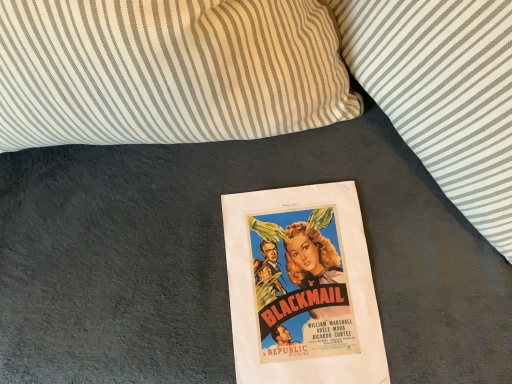
Question: Which direction should I rotate to look at striped fabric pillow at upper center, arranged as the 2th pillow when viewed from the left?

Choices:
 (A) left
 (B) right

Answer: (B)

Question: Is the position of striped fabric pillow at upper center, the 1th pillow from the right, less distant than that of white striped pillow at upper center, the 2th pillow viewed from the right?

Choices:
 (A) no
 (B) yes

Answer: (B)

Question: Is striped fabric pillow at upper center, the 1th pillow from the right, surrounding white striped pillow at upper center, the 2th pillow viewed from the right?

Choices:
 (A) yes
 (B) no

Answer: (B)

Question: Considering the relative sizes of striped fabric pillow at upper center, the 1th pillow from the right, and white striped pillow at upper center, the 2th pillow viewed from the right, in the image provided, is striped fabric pillow at upper center, the 1th pillow from the right, wider than white striped pillow at upper center, the 2th pillow viewed from the right,?

Choices:
 (A) no
 (B) yes

Answer: (B)

Question: Can you confirm if striped fabric pillow at upper center, arranged as the 2th pillow when viewed from the left, is taller than white striped pillow at upper center, the 2th pillow viewed from the right?

Choices:
 (A) yes
 (B) no

Answer: (B)

Question: Can you confirm if striped fabric pillow at upper center, the 1th pillow from the right, is shorter than white striped pillow at upper center, which is the 1th pillow from left to right?

Choices:
 (A) no
 (B) yes

Answer: (B)

Question: Considering the relative sizes of striped fabric pillow at upper center, arranged as the 2th pillow when viewed from the left, and white striped pillow at upper center, the 2th pillow viewed from the right, in the image provided, is striped fabric pillow at upper center, arranged as the 2th pillow when viewed from the left, thinner than white striped pillow at upper center, the 2th pillow viewed from the right,?

Choices:
 (A) no
 (B) yes

Answer: (A)

Question: Can you confirm if white striped pillow at upper center, the 2th pillow viewed from the right, is smaller than striped fabric pillow at upper center, the 1th pillow from the right?

Choices:
 (A) no
 (B) yes

Answer: (A)

Question: From a real-world perspective, is white striped pillow at upper center, which is the 1th pillow from left to right, located higher than striped fabric pillow at upper center, arranged as the 2th pillow when viewed from the left?

Choices:
 (A) yes
 (B) no

Answer: (B)

Question: Is white striped pillow at upper center, the 2th pillow viewed from the right, positioned behind striped fabric pillow at upper center, arranged as the 2th pillow when viewed from the left?

Choices:
 (A) no
 (B) yes

Answer: (B)

Question: Does white striped pillow at upper center, the 2th pillow viewed from the right, appear on the right side of striped fabric pillow at upper center, arranged as the 2th pillow when viewed from the left?

Choices:
 (A) no
 (B) yes

Answer: (A)

Question: Would you say striped fabric pillow at upper center, the 1th pillow from the right, is part of white striped pillow at upper center, the 2th pillow viewed from the right,'s contents?

Choices:
 (A) no
 (B) yes

Answer: (A)

Question: From the image's perspective, is white striped pillow at upper center, which is the 1th pillow from left to right, under striped fabric pillow at upper center, the 1th pillow from the right?

Choices:
 (A) yes
 (B) no

Answer: (B)

Question: Is white striped pillow at upper center, the 2th pillow viewed from the right, bigger or smaller than striped fabric pillow at upper center, the 1th pillow from the right?

Choices:
 (A) big
 (B) small

Answer: (A)